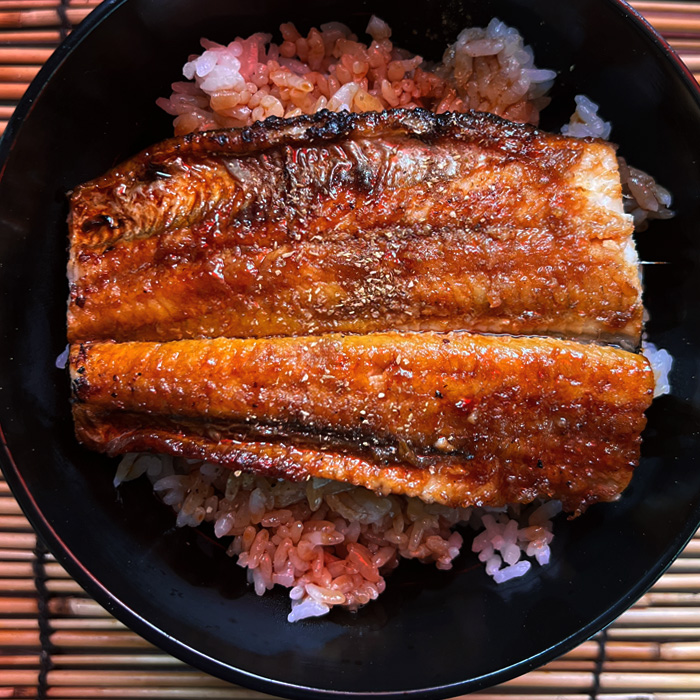
You are a GUI agent. You are given a task and a screenshot of the screen. Output one action in this format:
    pyautogui.click(x=<x>, y=<y>)
    Task: Click on the 1 black bowl
    The width and height of the screenshot is (700, 700).
    Given the screenshot: What is the action you would take?
    pyautogui.click(x=654, y=498)